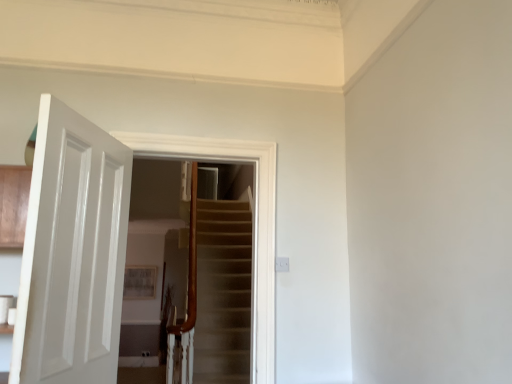
What do you see at coordinates (115, 238) in the screenshot? This screenshot has width=512, height=384. I see `white glossy door at center` at bounding box center [115, 238].

Find the location of a particular element. white glossy door at center is located at coordinates click(115, 238).

In order to face white glossy door at left, should I rotate leftwards or rightwards?

To align with it, rotate left about 22.139°.

This screenshot has height=384, width=512. Describe the element at coordinates (72, 253) in the screenshot. I see `white glossy door at left` at that location.

In order to click on white glossy door at left in this screenshot , I will do `click(72, 253)`.

Find the location of `white glossy door at center`. white glossy door at center is located at coordinates (115, 238).

In the image, is white glossy door at left on the left side or the right side of white glossy door at center?

In the image, white glossy door at left appears on the left side of white glossy door at center.

Which object is further away from the camera, white glossy door at left or white glossy door at center?

white glossy door at center.

Is point (76, 174) positioned after point (181, 148)?

No, it is in front of (181, 148).

From the image's perspective, is white glossy door at left positioned above or below white glossy door at center?

Clearly, from the image's perspective, white glossy door at left is below white glossy door at center.

Consider the image. From a real-world perspective, between white glossy door at left and white glossy door at center, who is vertically higher?

white glossy door at center.

Between white glossy door at left and white glossy door at center, which one has larger width?

Wider between the two is white glossy door at left.

Considering the sizes of white glossy door at left and white glossy door at center in the image, is white glossy door at left taller or shorter than white glossy door at center?

In the image, white glossy door at left appears to be shorter than white glossy door at center.

Who is smaller, white glossy door at left or white glossy door at center?

white glossy door at left is smaller.

Is white glossy door at center a part of white glossy door at left?

That's incorrect, white glossy door at center is not inside white glossy door at left.

Would you say white glossy door at left is a long distance from white glossy door at center?

No.

Is white glossy door at center at the back of white glossy door at left?

white glossy door at left does not have its back to white glossy door at center.

Can you tell me how much white glossy door at left and white glossy door at center differ in facing direction?

They differ by 72.4 degrees in their facing directions.

Identify the location of door in front of the white glossy door at center. (72, 253).

Which object is positioned more to the left, white glossy door at center or white glossy door at left?

white glossy door at left is more to the left.

Is white glossy door at center in front of white glossy door at left?

No, it is not.

Considering the positions of points (28, 258) and (42, 198), is point (28, 258) closer to camera compared to point (42, 198)?

Yes, point (28, 258) is in front of point (42, 198).

From the image's perspective, would you say white glossy door at center is shown under white glossy door at left?

No, from the image's perspective, white glossy door at center is not beneath white glossy door at left.

From a real-world perspective, who is located lower, white glossy door at center or white glossy door at left?

white glossy door at left is physically lower.

Looking at their sizes, would you say white glossy door at center is wider or thinner than white glossy door at left?

In the image, white glossy door at center appears to be more narrow than white glossy door at left.

Considering the sizes of objects white glossy door at center and white glossy door at left in the image provided, who is shorter, white glossy door at center or white glossy door at left?

With less height is white glossy door at left.

Looking at this image, which of these two, white glossy door at center or white glossy door at left, is smaller?

white glossy door at left.

Can white glossy door at left be found inside white glossy door at center?

Actually, white glossy door at left is outside white glossy door at center.

Is white glossy door at center next to white glossy door at left and touching it?

Absolutely, white glossy door at center is next to and touching white glossy door at left.

Does white glossy door at center turn towards white glossy door at left?

Yes, white glossy door at center is oriented towards white glossy door at left.

You are a GUI agent. You are given a task and a screenshot of the screen. Output one action in this format:
    pyautogui.click(x=<x>, y=<y>)
    Task: Click on the screen door on the right of white glossy door at left
    This screenshot has height=384, width=512.
    Given the screenshot: What is the action you would take?
    pyautogui.click(x=115, y=238)

Locate an element on the screen. This screenshot has width=512, height=384. door in front of the white glossy door at center is located at coordinates (72, 253).

Find the location of a particular element. screen door that appears above the white glossy door at left (from a real-world perspective) is located at coordinates (115, 238).